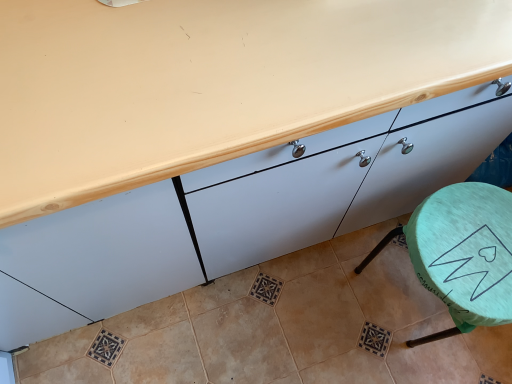
Question: From the image's perspective, does green fabric stool at lower right appear lower than matte white cabinet at center?

Choices:
 (A) no
 (B) yes

Answer: (B)

Question: Is green fabric stool at lower right facing towards matte white cabinet at center?

Choices:
 (A) yes
 (B) no

Answer: (B)

Question: Is green fabric stool at lower right positioned far away from matte white cabinet at center?

Choices:
 (A) no
 (B) yes

Answer: (A)

Question: From a real-world perspective, is green fabric stool at lower right beneath matte white cabinet at center?

Choices:
 (A) yes
 (B) no

Answer: (A)

Question: Can you confirm if green fabric stool at lower right is thinner than matte white cabinet at center?

Choices:
 (A) no
 (B) yes

Answer: (B)

Question: Is green fabric stool at lower right smaller than matte white cabinet at center?

Choices:
 (A) yes
 (B) no

Answer: (A)

Question: Is matte white cabinet at center thinner than green fabric stool at lower right?

Choices:
 (A) no
 (B) yes

Answer: (A)

Question: Is matte white cabinet at center to the left of green fabric stool at lower right from the viewer's perspective?

Choices:
 (A) yes
 (B) no

Answer: (A)

Question: From a real-world perspective, is matte white cabinet at center located higher than green fabric stool at lower right?

Choices:
 (A) yes
 (B) no

Answer: (A)

Question: From a real-world perspective, is matte white cabinet at center physically below green fabric stool at lower right?

Choices:
 (A) yes
 (B) no

Answer: (B)

Question: Does matte white cabinet at center have a lesser height compared to green fabric stool at lower right?

Choices:
 (A) no
 (B) yes

Answer: (A)

Question: Is matte white cabinet at center outside green fabric stool at lower right?

Choices:
 (A) yes
 (B) no

Answer: (A)

Question: Would you say green fabric stool at lower right is inside or outside matte white cabinet at center?

Choices:
 (A) inside
 (B) outside

Answer: (B)